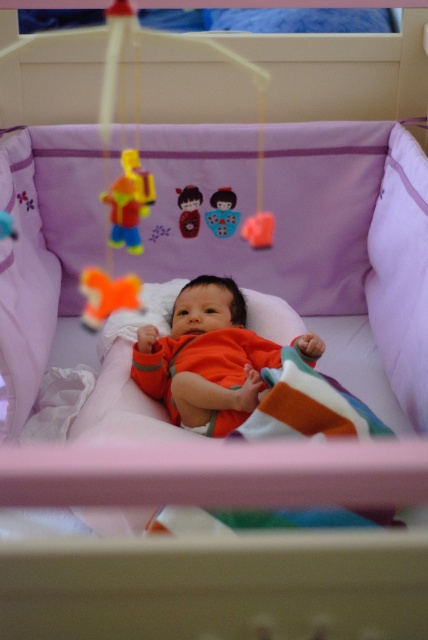
At what (x,y) coordinates should I click in order to perform the action: click on orange soft fabric baby at center. Please return your answer as a coordinate pair (x, y). This screenshot has height=640, width=428. Looking at the image, I should click on (205, 358).

Does orange soft fabric baby at center have a greater width compared to yellow plastic toy at upper center?

Yes, orange soft fabric baby at center is wider than yellow plastic toy at upper center.

Who is more forward, (216, 321) or (151, 177)?

Point (216, 321) is in front.

Where is `orange soft fabric baby at center`? The height and width of the screenshot is (640, 428). orange soft fabric baby at center is located at coordinates (205, 358).

This screenshot has width=428, height=640. I want to click on orange plush toy at center, so click(107, 296).

Who is higher up, orange plush toy at center or matte plastic doll at upper center?

Positioned higher is matte plastic doll at upper center.

Find the location of `orange plush toy at center`. orange plush toy at center is located at coordinates (107, 296).

Which is below, purple soft pillow at right or yellow plastic toy at upper center?

purple soft pillow at right is lower down.

Is purple soft pillow at right smaller than yellow plastic toy at upper center?

Actually, purple soft pillow at right might be larger than yellow plastic toy at upper center.

This screenshot has height=640, width=428. Find the location of `purple soft pillow at right`. purple soft pillow at right is located at coordinates (401, 275).